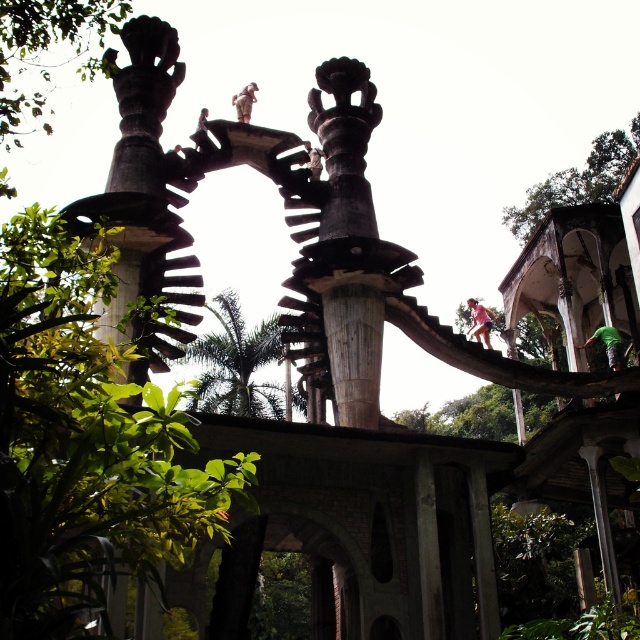
What do you see at coordinates (48, 52) in the screenshot? Image resolution: width=640 pixels, height=640 pixels. I see `green leafy tree at upper left` at bounding box center [48, 52].

Between green leafy tree at upper left and green leafy tree at center, which one has more height?

Standing taller between the two is green leafy tree at upper left.

Describe the element at coordinates (48, 52) in the screenshot. I see `green leafy tree at upper left` at that location.

In order to click on green leafy tree at upper left in this screenshot , I will do `click(48, 52)`.

Find the location of `green leafy tree at upper right`. green leafy tree at upper right is located at coordinates [x=577, y=180].

Does point (561, 177) lie in front of point (252, 92)?

That is False.

Describe the element at coordinates (577, 180) in the screenshot. I see `green leafy tree at upper right` at that location.

This screenshot has width=640, height=640. In order to click on green leafy tree at upper right in this screenshot , I will do `click(577, 180)`.

This screenshot has width=640, height=640. Find the location of `green leafy tree at upper left`. green leafy tree at upper left is located at coordinates (48, 52).

Is point (1, 120) farther from viewer compared to point (577, 173)?

No, (1, 120) is closer to viewer.

Identify the location of green leafy tree at upper left. The height and width of the screenshot is (640, 640). (48, 52).